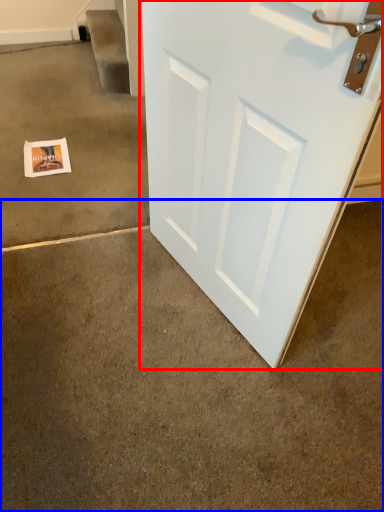
Question: Which of the following is the farthest to the observer, door (highlighted by a red box) or concrete (highlighted by a blue box)?

Choices:
 (A) door
 (B) concrete

Answer: (B)